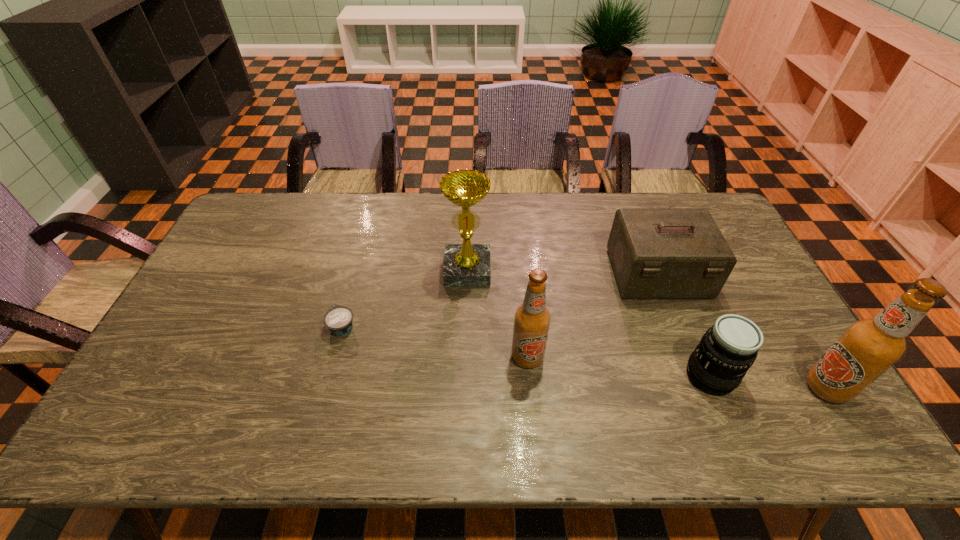
The image size is (960, 540). I want to click on the shorter beer bottle, so click(532, 319).

At what (x,y) coordinates should I click in order to perform the action: click on the left beer bottle. Please return your answer as a coordinate pair (x, y). Looking at the image, I should click on (532, 319).

You are a GUI agent. You are given a task and a screenshot of the screen. Output one action in this format:
    pyautogui.click(x=<x>, y=<y>)
    Task: Click on the right beer bottle
    Image resolution: width=960 pixels, height=540 pixels.
    Given the screenshot: What is the action you would take?
    pyautogui.click(x=868, y=347)

Image resolution: width=960 pixels, height=540 pixels. I want to click on the rightmost object, so click(x=868, y=347).

The width and height of the screenshot is (960, 540). Identify the location of the first-aid kit. (657, 253).

The image size is (960, 540). Find the location of `the fifth object from right to left`. the fifth object from right to left is located at coordinates pyautogui.click(x=465, y=265).

Identify the location of the leftmost object. (339, 320).

Locate an element on the screen. the shortest object is located at coordinates (339, 320).

You are a GUI agent. You are given a task and a screenshot of the screen. Output one action in this format:
    pyautogui.click(x=<x>, y=<y>)
    Task: Click on the telephoto lens
    The width and height of the screenshot is (960, 540).
    Given the screenshot: What is the action you would take?
    pyautogui.click(x=727, y=350)

Identify the location of vacant space located on the front label of the third object from left to right. (530, 389).